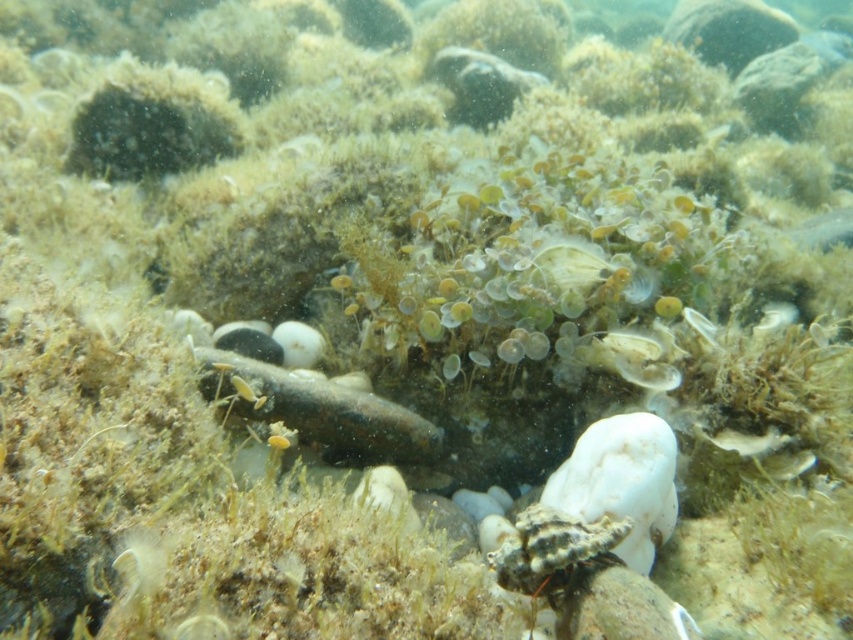
You are a marine biologist observing an underwater scene. You notice a speckled brown fish at center. Can you determine its exact coordinates in the image?

The speckled brown fish at center is located at point (318, 410).

You are a diver exploring the underwater scene. You notice two points marked in the image. From your vantage point, which point is closer to you? The points are point at (570, 588) and point at (746, 449).

Point at (570, 588) is in front of point at (746, 449), so it is closer to you.